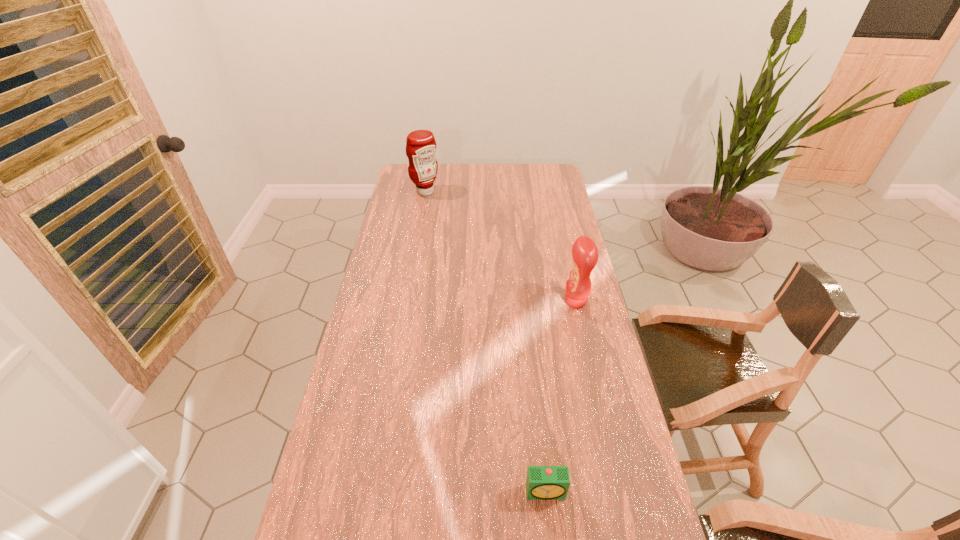
Identify which object is located as the nearest to the left condiment. Please provide its 2D coordinates. Your answer should be formatted as a tuple, i.e. [(x, y)], where the tuple contains the x and y coordinates of a point satisfying the conditions above.

[(584, 251)]

Identify the location of vacant space that satisfies the following two spatial constraints: 1. on the label side of the rightmost object; 2. on the front-facing side of the second object from right to left. The height and width of the screenshot is (540, 960). pos(618,492).

In order to click on blank space that satisfies the following two spatial constraints: 1. on the label side of the second farthest object; 2. on the front-facing side of the second object from right to left in this screenshot , I will do `click(618, 492)`.

The width and height of the screenshot is (960, 540). What are the coordinates of `blank space that satisfies the following two spatial constraints: 1. on the label side of the nearer condiment; 2. on the front-facing side of the nearest object` in the screenshot? It's located at (618, 492).